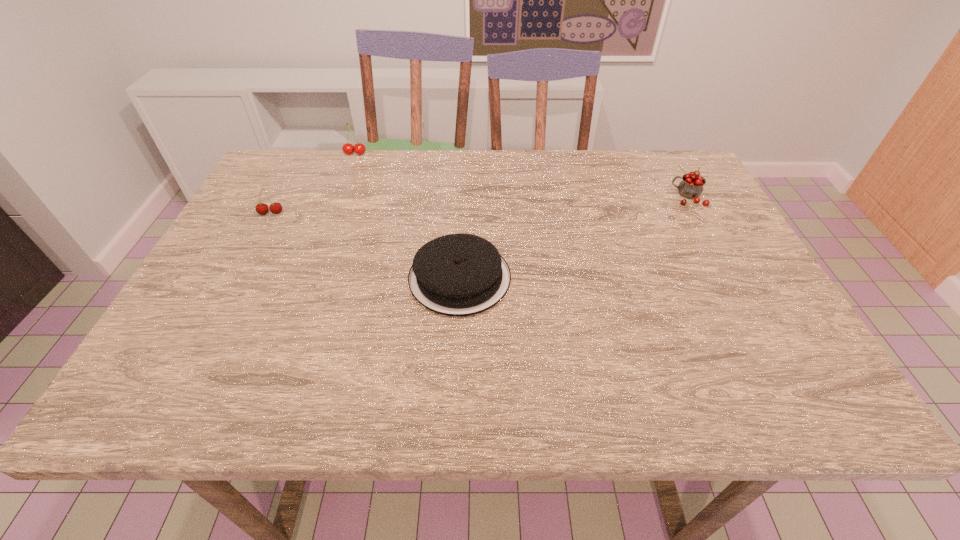
The height and width of the screenshot is (540, 960). I want to click on vacant region that satisfies the following two spatial constraints: 1. on the handle side of the rightmost cherry; 2. with the stems of the farthest cherry pointing upwards, so click(663, 153).

Identify the location of free space that satisfies the following two spatial constraints: 1. with the stems of the shortest object pointing upwards; 2. on the right side of the farthest object. (308, 278).